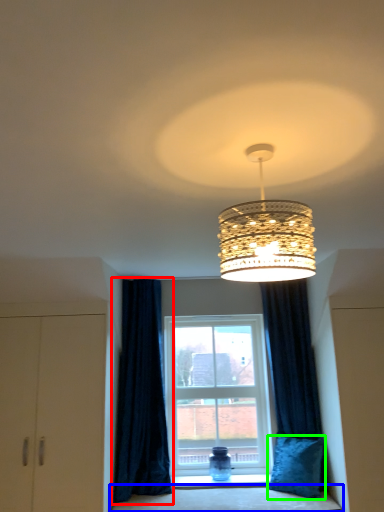
Question: Based on their relative distances, which object is nearer to curtain (highlighted by a red box)? Choose from bedding (highlighted by a blue box) and pillow (highlighted by a green box).

Choices:
 (A) bedding
 (B) pillow

Answer: (A)